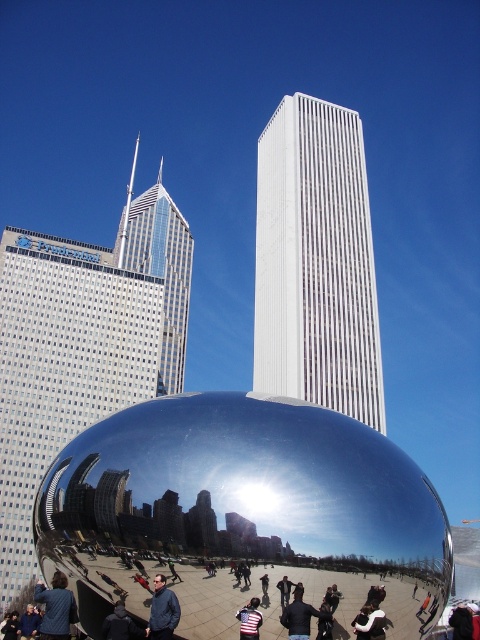
Question: Estimate the real-world distances between objects in this image. Which object is farther from the blue denim jacket at lower center?

Choices:
 (A) striped shirt at center
 (B) denim jacket at lower left

Answer: (B)

Question: Which object is closer to the camera taking this photo?

Choices:
 (A) striped shirt at center
 (B) dark blue jacket at center

Answer: (A)

Question: Can you confirm if blue denim jacket at lower center is smaller than dark blue jacket at center?

Choices:
 (A) no
 (B) yes

Answer: (A)

Question: Which point appears farthest from the camera in this image?

Choices:
 (A) (256, 611)
 (B) (303, 636)
 (C) (151, 621)
 (D) (48, 596)

Answer: (D)

Question: Does dark blue jacket at center appear over striped shirt at center?

Choices:
 (A) yes
 (B) no

Answer: (A)

Question: Observing the image, what is the correct spatial positioning of denim jacket at lower left in reference to dark blue jacket at center?

Choices:
 (A) below
 (B) above

Answer: (A)